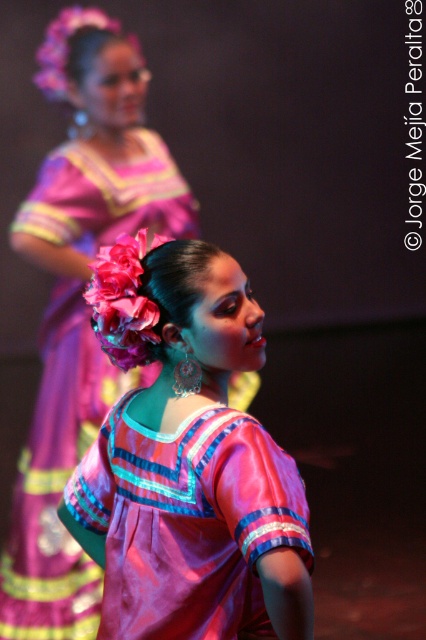
Based on the photo, who is more forward, (x=213, y=557) or (x=80, y=344)?

Positioned in front is point (x=213, y=557).

Consider the image. Between silky pink blouse at center and pink satin dress at center, which one appears on the right side from the viewer's perspective?

silky pink blouse at center is more to the right.

I want to click on silky pink blouse at center, so click(187, 460).

Where is `silky pink blouse at center`? silky pink blouse at center is located at coordinates [187, 460].